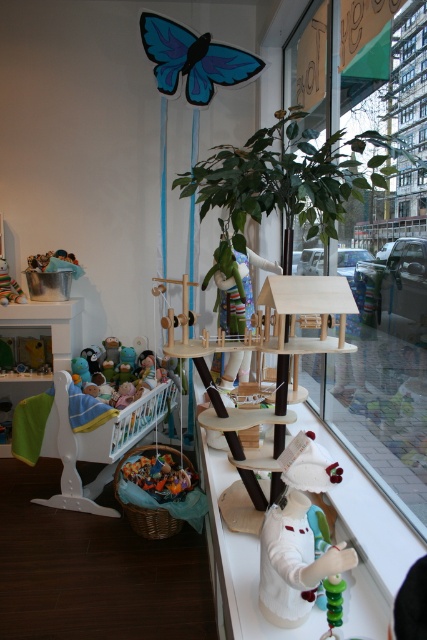
Question: In this image, where is blue matte butterfly at upper center located relative to white matte fireplace at left?

Choices:
 (A) right
 (B) left

Answer: (A)

Question: Observing the image, what is the correct spatial positioning of white matte rabbit at center in reference to blue matte butterfly at upper center?

Choices:
 (A) below
 (B) above

Answer: (A)

Question: Can you confirm if blue matte butterfly at upper center is positioned above white matte fireplace at left?

Choices:
 (A) no
 (B) yes

Answer: (B)

Question: Which object is closer to the camera taking this photo?

Choices:
 (A) velvet plush monkey at left
 (B) blue matte butterfly at upper center
 (C) white matte fireplace at left
 (D) green leafy plant at center

Answer: (D)

Question: Among these points, which one is nearest to the camera?

Choices:
 (A) (388, 360)
 (B) (283, 480)

Answer: (B)

Question: Which object is positioned farthest from the white matte fireplace at left?

Choices:
 (A) white matte rabbit at center
 (B) soft plush toys at left
 (C) green leafy plant at center
 (D) blue matte butterfly at upper center

Answer: (A)